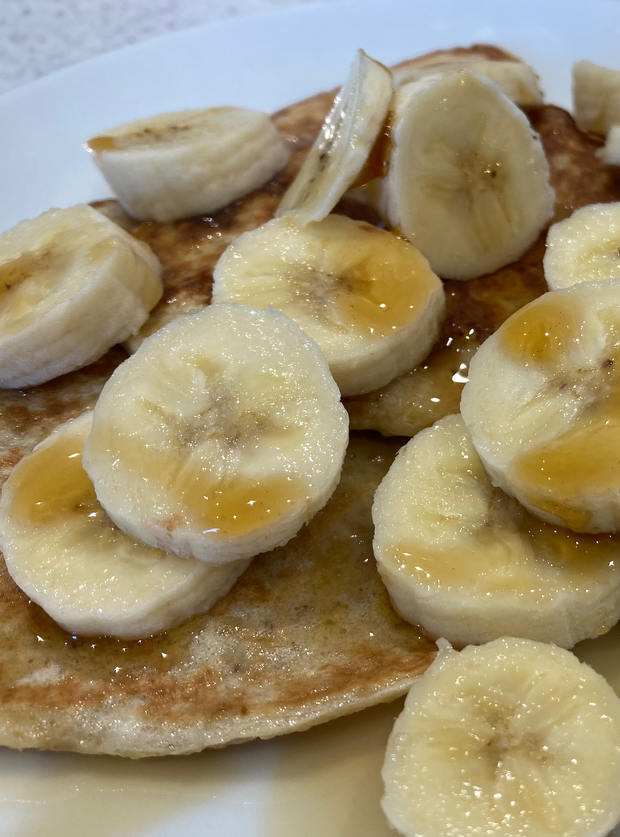
Where is `floor`? floor is located at coordinates (56, 26).